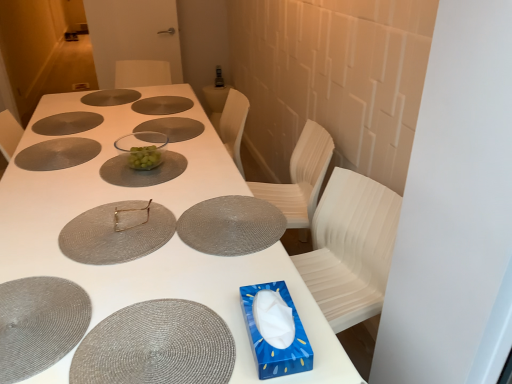
At what (x,y) coordinates should I click in order to perform the action: click on free space in front of matte gray glass plate at upper left, which is the 5th glass plate in back-to-front order. Please return your answer as a coordinate pair (x, y). This screenshot has width=512, height=384. Looking at the image, I should click on (47, 179).